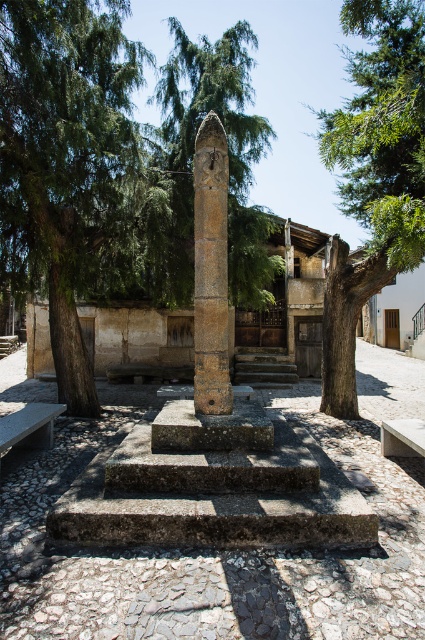
Question: Which is farther from the green leafy tree at right?

Choices:
 (A) brown stone column at center
 (B) green leafy tree at left

Answer: (B)

Question: Does green leafy tree at right have a smaller size compared to brown stone column at center?

Choices:
 (A) yes
 (B) no

Answer: (B)

Question: Which of the following is the closest to the observer?

Choices:
 (A) coord(226,164)
 (B) coord(116,52)
 (C) coord(371,54)

Answer: (A)

Question: Which object appears farthest from the camera in this image?

Choices:
 (A) green leafy tree at left
 (B) green leafy tree at right

Answer: (A)

Question: Is the position of green leafy tree at left more distant than that of green leafy tree at right?

Choices:
 (A) yes
 (B) no

Answer: (A)

Question: Is green leafy tree at right bigger than brown stone column at center?

Choices:
 (A) yes
 (B) no

Answer: (A)